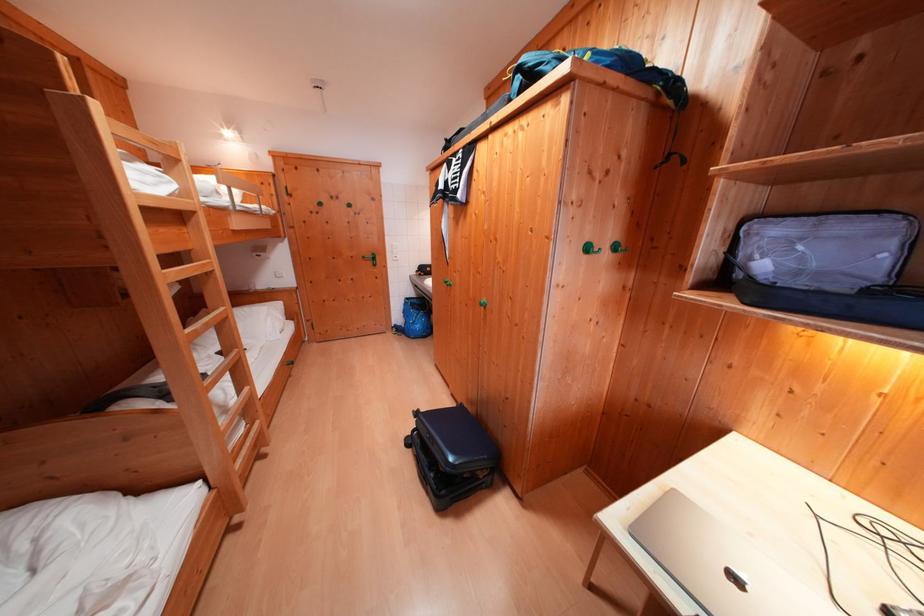
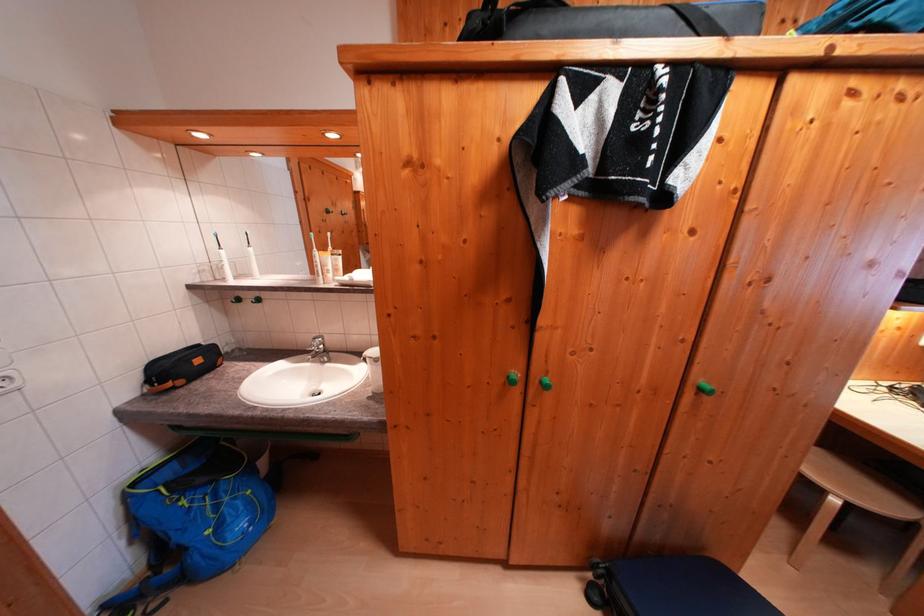
Find the pixel in the second image that matches pixel 416 302 in the first image.

(142, 488)